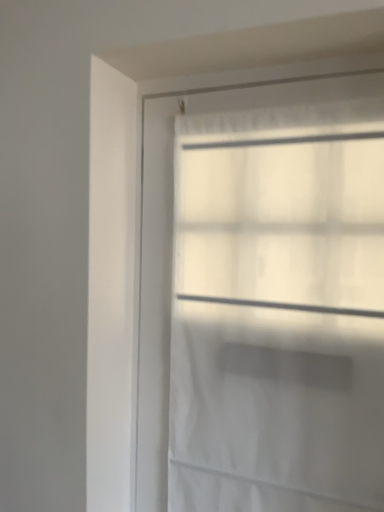
This screenshot has width=384, height=512. Identify the location of white sheer curtain at upper center. [x=278, y=310].

Describe the element at coordinates (278, 310) in the screenshot. The height and width of the screenshot is (512, 384). I see `white sheer curtain at upper center` at that location.

Locate an element on the screen. white sheer curtain at upper center is located at coordinates (278, 310).